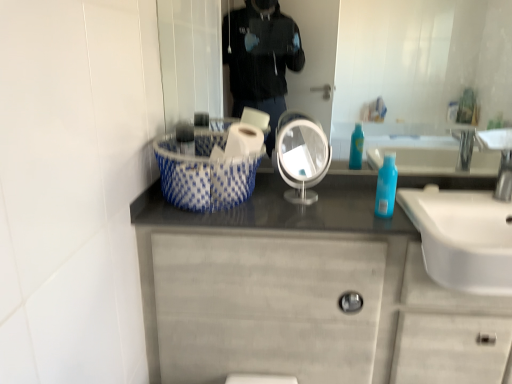
Describe the element at coordinates (386, 186) in the screenshot. I see `blue glossy bottle at right` at that location.

The width and height of the screenshot is (512, 384). I want to click on matte gray cabinet at center, so click(305, 293).

This screenshot has width=512, height=384. Describe the element at coordinates (302, 158) in the screenshot. I see `white glossy mirror at center, the 2th mirror viewed from the right` at that location.

In order to click on white glossy sink at right in this screenshot , I will do `click(468, 227)`.

Is blue dotted fabric basket at center turned away from white glossy mirror at center, the 2th mirror viewed from the right?

blue dotted fabric basket at center is not turned away from white glossy mirror at center, the 2th mirror viewed from the right.

In the scene shown: Who is taller, blue dotted fabric basket at center or white glossy mirror at center, the 2th mirror viewed from the right?

white glossy mirror at center, the 2th mirror viewed from the right.

From the image's perspective, who appears lower, blue dotted fabric basket at center or white glossy mirror at center, the 2th mirror viewed from the right?

blue dotted fabric basket at center.

From a real-world perspective, which object stands above the other?

white glossy toilet paper at center.

Would you say white glossy toilet paper at center is to the left or to the right of blue dotted fabric basket at center in the picture?

Based on their positions, white glossy toilet paper at center is located to the right of blue dotted fabric basket at center.

Can you confirm if white glossy toilet paper at center is taller than blue dotted fabric basket at center?

Incorrect, the height of white glossy toilet paper at center is not larger of that of blue dotted fabric basket at center.

The width and height of the screenshot is (512, 384). Find the location of `toilet paper located above the blue dotted fabric basket at center (from a real-world perspective)`. toilet paper located above the blue dotted fabric basket at center (from a real-world perspective) is located at coordinates (243, 140).

Is white glossy mirror at center, the 2th mirror viewed from the right, positioned with its back to white glossy toilet paper at center?

No.

Considering the positions of objects white glossy mirror at center, the 2th mirror viewed from the right, and white glossy toilet paper at center in the image provided, who is more to the left, white glossy mirror at center, the 2th mirror viewed from the right, or white glossy toilet paper at center?

white glossy toilet paper at center is more to the left.

Can you tell me how much white glossy mirror at center, the first mirror in the left-to-right sequence, and white glossy toilet paper at center differ in facing direction?

There is a 35.8-degree angle between the facing directions of white glossy mirror at center, the first mirror in the left-to-right sequence, and white glossy toilet paper at center.

Who is taller, white glossy sink at right or blue dotted fabric basket at center?

Standing taller between the two is blue dotted fabric basket at center.

Find the location of a particular element. Image resolution: width=512 pixels, height=384 pixels. sink below the blue dotted fabric basket at center (from the image's perspective) is located at coordinates (468, 227).

In the scene shown: Can you confirm if white glossy sink at right is positioned to the left of blue dotted fabric basket at center?

No, white glossy sink at right is not to the left of blue dotted fabric basket at center.

Does white glossy sink at right have a lesser width compared to blue dotted fabric basket at center?

No.

What's the angular difference between matte gray cabinet at center and white glossy sink at right's facing directions?

They differ by 0.894 degrees in their facing directions.

Locate an element on the screen. This screenshot has width=512, height=384. sink positioned vertically above the matte gray cabinet at center (from a real-world perspective) is located at coordinates (468, 227).

Can you confirm if matte gray cabinet at center is wider than white glossy sink at right?

Incorrect, the width of matte gray cabinet at center does not surpass that of white glossy sink at right.

From a real-world perspective, is matte silver mirror at center, which is the second mirror in left-to-right order, physically above white glossy sink at right?

Yes, from a real-world perspective, matte silver mirror at center, which is the second mirror in left-to-right order, is over white glossy sink at right

Locate an element on the screen. This screenshot has height=384, width=512. mirror that is the 2nd object above the white glossy sink at right (from a real-world perspective) is located at coordinates (401, 61).

Based on the photo, from the image's perspective, is matte silver mirror at center, which is the second mirror in left-to-right order, beneath white glossy sink at right?

Incorrect, from the image's perspective, matte silver mirror at center, which is the second mirror in left-to-right order, is higher than white glossy sink at right.

From a real-world perspective, between matte silver mirror at center, marked as the first mirror in a right-to-left arrangement, and white glossy mirror at center, the first mirror in the left-to-right sequence, who is vertically higher?

matte silver mirror at center, marked as the first mirror in a right-to-left arrangement.

Image resolution: width=512 pixels, height=384 pixels. In the image, there is a white glossy mirror at center, the 2th mirror viewed from the right. Find the location of `mirror above it (from the image's perspective)`. mirror above it (from the image's perspective) is located at coordinates (401, 61).

Is matte silver mirror at center, which is the second mirror in left-to-right order, in front of white glossy mirror at center, the 2th mirror viewed from the right?

No, it is not.

Can white glossy mirror at center, the 2th mirror viewed from the right, be found inside matte silver mirror at center, which is the second mirror in left-to-right order?

No, white glossy mirror at center, the 2th mirror viewed from the right, is not inside matte silver mirror at center, which is the second mirror in left-to-right order.

At what (x,y) coordinates should I click in order to perform the action: click on the 1st mirror behind the blue dotted fabric basket at center. Please return your answer as a coordinate pair (x, y). The image size is (512, 384). Looking at the image, I should click on (302, 158).

You are a GUI agent. You are given a task and a screenshot of the screen. Output one action in this format:
    pyautogui.click(x=<x>, y=<y>)
    Task: Click on the toilet paper located above the blue dotted fabric basket at center (from the image's perspective)
    This screenshot has height=384, width=512.
    Given the screenshot: What is the action you would take?
    pyautogui.click(x=243, y=140)

When comparing their distances from white glossy sink at right, does matte silver mirror at center, marked as the first mirror in a right-to-left arrangement, or white glossy toilet paper at center seem further?

matte silver mirror at center, marked as the first mirror in a right-to-left arrangement, is further to white glossy sink at right.

Looking at the image, which one is located further to blue dotted fabric basket at center, blue glossy bottle at right or white glossy mirror at center, the first mirror in the left-to-right sequence?

Among the two, blue glossy bottle at right is located further to blue dotted fabric basket at center.

From the picture: Looking at the image, which one is located further to white glossy mirror at center, the 2th mirror viewed from the right, white glossy toilet paper at center or blue dotted fabric basket at center?

blue dotted fabric basket at center is positioned further to the anchor white glossy mirror at center, the 2th mirror viewed from the right.

From the picture: Estimate the real-world distances between objects in this image. Which object is further from matte silver mirror at center, marked as the first mirror in a right-to-left arrangement, matte gray cabinet at center or white glossy sink at right?

matte gray cabinet at center is further to matte silver mirror at center, marked as the first mirror in a right-to-left arrangement.

Considering their positions, is blue dotted fabric basket at center positioned further to blue glossy bottle at right than matte gray cabinet at center?

Among the two, blue dotted fabric basket at center is located further to blue glossy bottle at right.

Which object lies nearer to the anchor point blue dotted fabric basket at center, white glossy mirror at center, the first mirror in the left-to-right sequence, or matte gray cabinet at center?

The object closer to blue dotted fabric basket at center is white glossy mirror at center, the first mirror in the left-to-right sequence.

When comparing their distances from matte silver mirror at center, marked as the first mirror in a right-to-left arrangement, does white glossy toilet paper at center or blue glossy bottle at right seem further?

white glossy toilet paper at center.

Based on their spatial positions, is blue dotted fabric basket at center or white glossy toilet paper at center closer to blue glossy bottle at right?

white glossy toilet paper at center.

You are a GUI agent. You are given a task and a screenshot of the screen. Output one action in this format:
    pyautogui.click(x=<x>, y=<y>)
    Task: Click on the bathroom cabinet located between white glossy toilet paper at center and white glossy sink at right in the left-right direction
    This screenshot has height=384, width=512.
    Given the screenshot: What is the action you would take?
    pyautogui.click(x=305, y=293)

The image size is (512, 384). I want to click on mouthwash between white glossy toilet paper at center and matte gray cabinet at center in the vertical direction, so click(386, 186).

This screenshot has width=512, height=384. I want to click on mouthwash between white glossy mirror at center, the 2th mirror viewed from the right, and white glossy sink at right, in the horizontal direction, so click(386, 186).

Locate an element on the screen. basket between matte silver mirror at center, which is the second mirror in left-to-right order, and matte gray cabinet at center vertically is located at coordinates (205, 171).